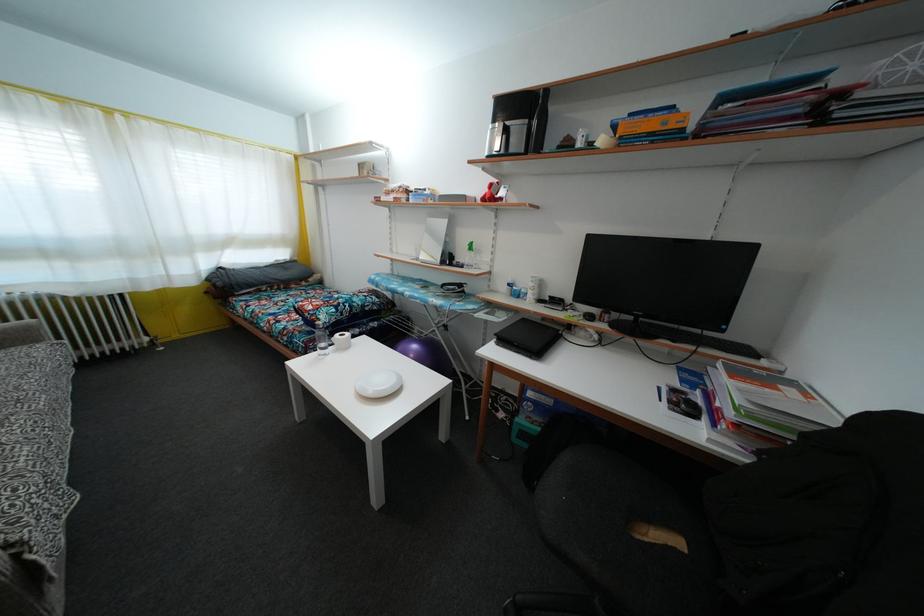
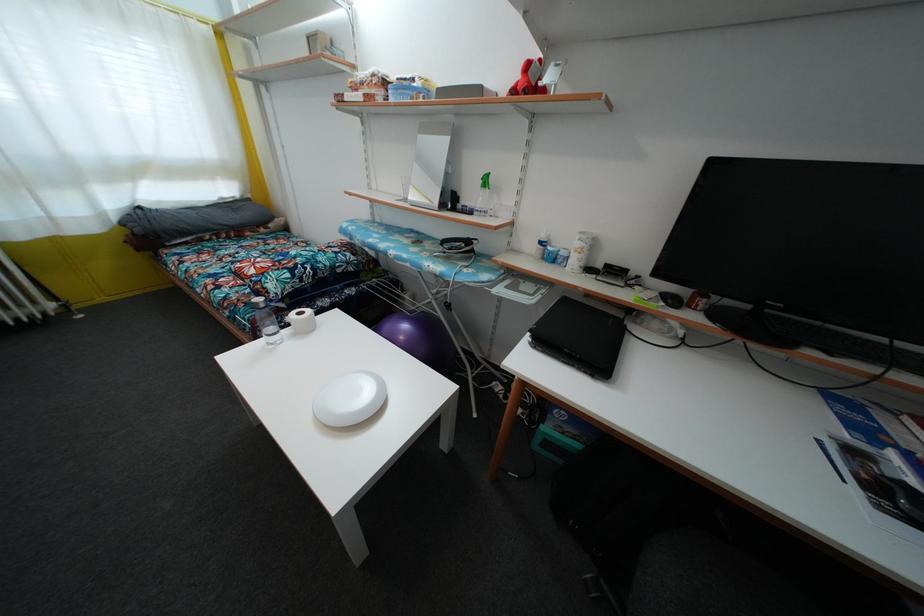
Question: What movement of the cameraman would produce the second image?

Choices:
 (A) Left
 (B) Right
 (C) Forward
 (D) Backward

Answer: (C)